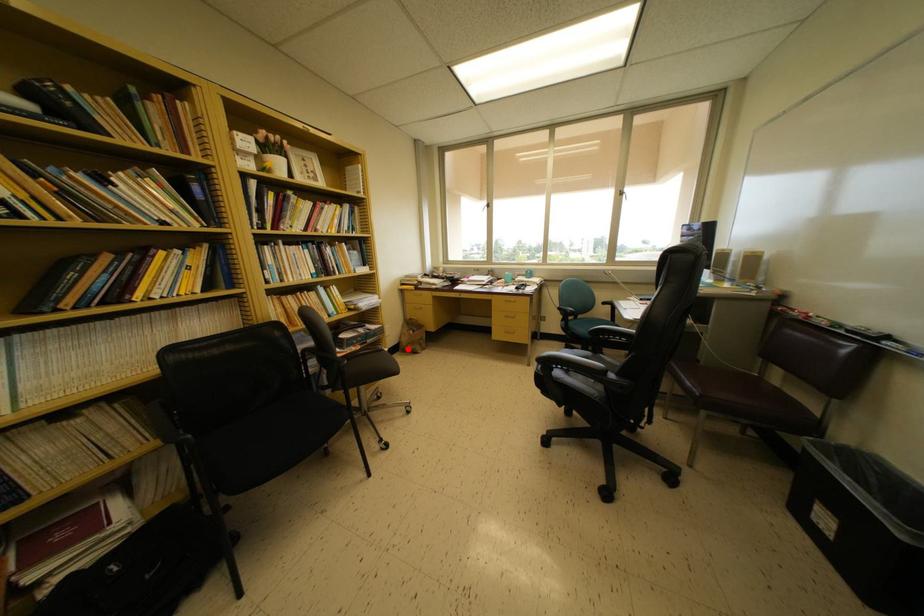
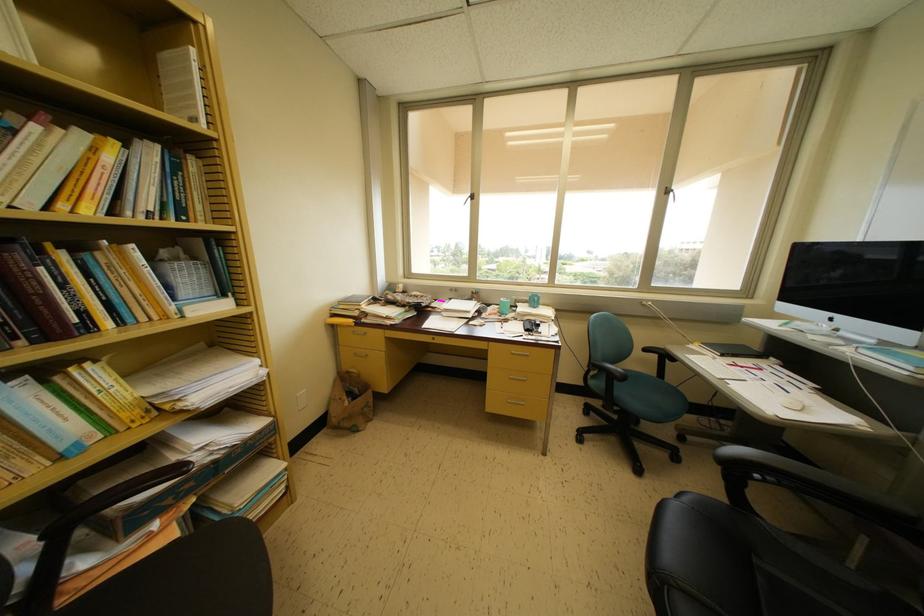
In the second image, find the point that corresponds to the highlighted location in the first image.

(337, 424)